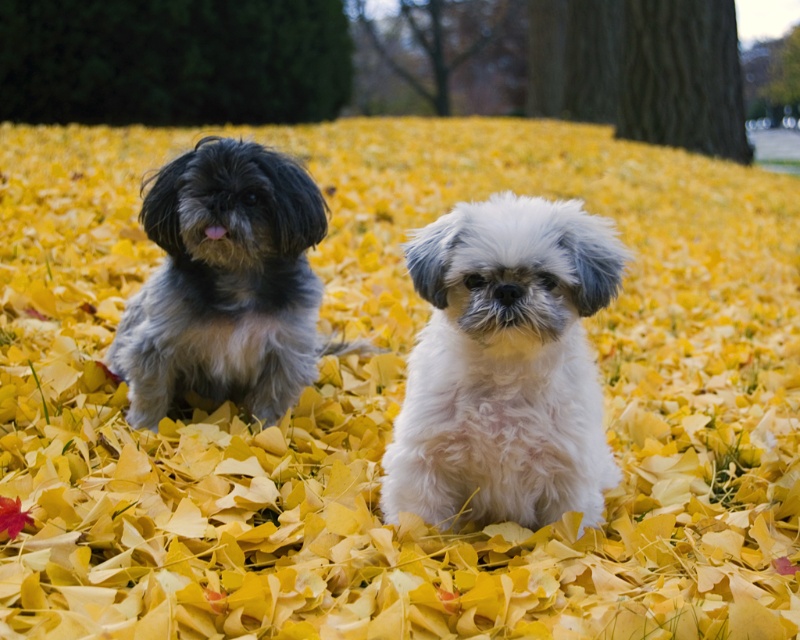
You are taking a photo of the scene and want to focus on the white fluffy dog at center. Where should you aim your camera to ensure it is in focus?

You should aim your camera at point (504, 365) to focus on the white fluffy dog at center.

You are a photographer trying to capture both dogs in a single frame. Given that the white fluffy dog at center is smaller in width than the fluffy gray dog at left, which dog should you position closer to the camera to ensure both appear equally sized in the photo?

To make both dogs appear equally sized in the photo, position the white fluffy dog at center closer to the camera since it has a lesser width compared to the fluffy gray dog at left. This adjustment will help balance their apparent sizes in the frame.

You are a photographer trying to capture both the white fluffy dog at center and the fluffy gray dog at left in a single shot. Based on their positions, which dog would appear closer to the camera in the photo?

The white fluffy dog at center appears closer to the camera because it is located below the fluffy gray dog at left, indicating it is positioned lower in the frame and thus nearer to the viewer.